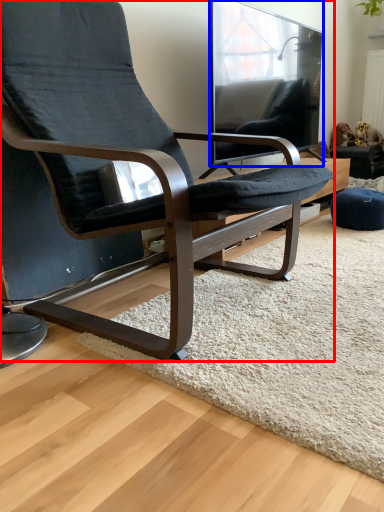
Question: Which point is further to the camera, chair (highlighted by a red box) or window (highlighted by a blue box)?

Choices:
 (A) chair
 (B) window

Answer: (B)